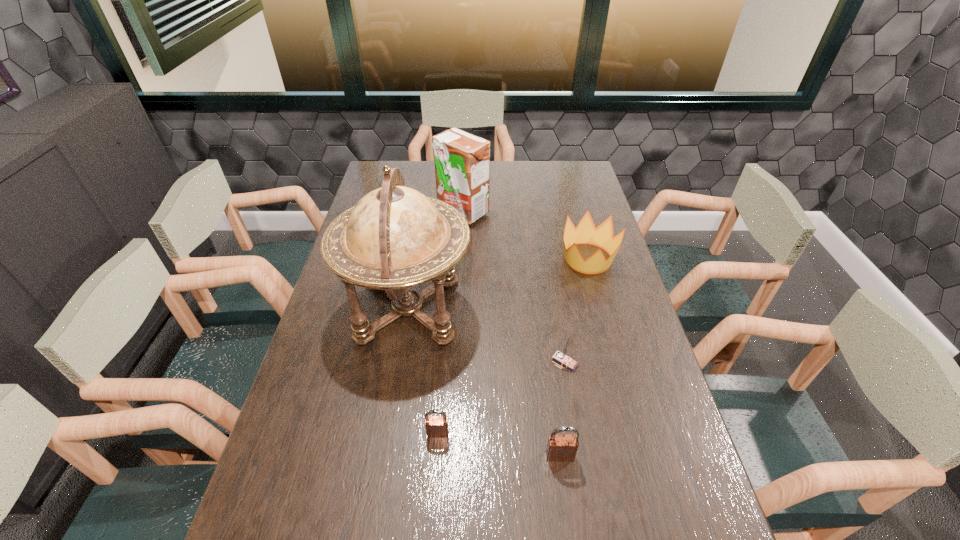
This screenshot has width=960, height=540. I want to click on the farther padlock, so click(x=436, y=426).

Identify the location of the shorter padlock. This screenshot has height=540, width=960. [436, 426].

In order to click on the right padlock in this screenshot , I will do `click(560, 447)`.

The width and height of the screenshot is (960, 540). In order to click on the taller padlock in this screenshot , I will do click(x=560, y=447).

Where is `the fifth shortest object`? the fifth shortest object is located at coordinates (462, 160).

This screenshot has width=960, height=540. I want to click on the farthest object, so click(462, 160).

Where is `matchbox`? The image size is (960, 540). matchbox is located at coordinates (561, 357).

Locate an element on the screen. The height and width of the screenshot is (540, 960). crown is located at coordinates coord(585,233).

This screenshot has height=540, width=960. What are the coordinates of `the tallest object` in the screenshot? It's located at (394, 238).

Identify the location of free space located on the front-facing side of the shortest object. This screenshot has height=540, width=960. (435, 468).